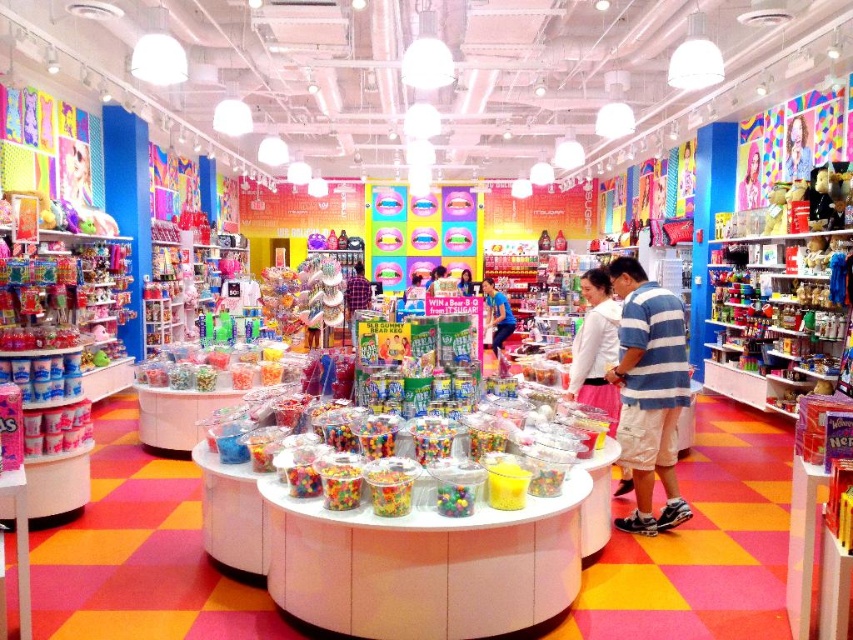
Who is more distant from viewer, (805, 145) or (467, 296)?

The point (467, 296) is behind.

What do you see at coordinates (798, 147) in the screenshot?
I see `smooth plastic toy at center` at bounding box center [798, 147].

Locate an element on the screen. The width and height of the screenshot is (853, 640). smooth plastic toy at center is located at coordinates (798, 147).

Can you confirm if blue fabric shirt at center is taller than matte blue shirt at center?

Indeed, blue fabric shirt at center has a greater height compared to matte blue shirt at center.

Does blue fabric shirt at center appear under matte blue shirt at center?

Yes.

This screenshot has height=640, width=853. Describe the element at coordinates (497, 314) in the screenshot. I see `blue fabric shirt at center` at that location.

I want to click on blue fabric shirt at center, so click(497, 314).

Consider the image. Between smooth plastic toy at center and matte blue shirt at center, which one is positioned higher?

Positioned higher is smooth plastic toy at center.

The image size is (853, 640). Find the location of `smooth plastic toy at center`. smooth plastic toy at center is located at coordinates (798, 147).

Is point (793, 132) positioned before point (437, 266)?

Yes, point (793, 132) is closer to viewer.

The height and width of the screenshot is (640, 853). Identify the location of smooth plastic toy at center. (798, 147).